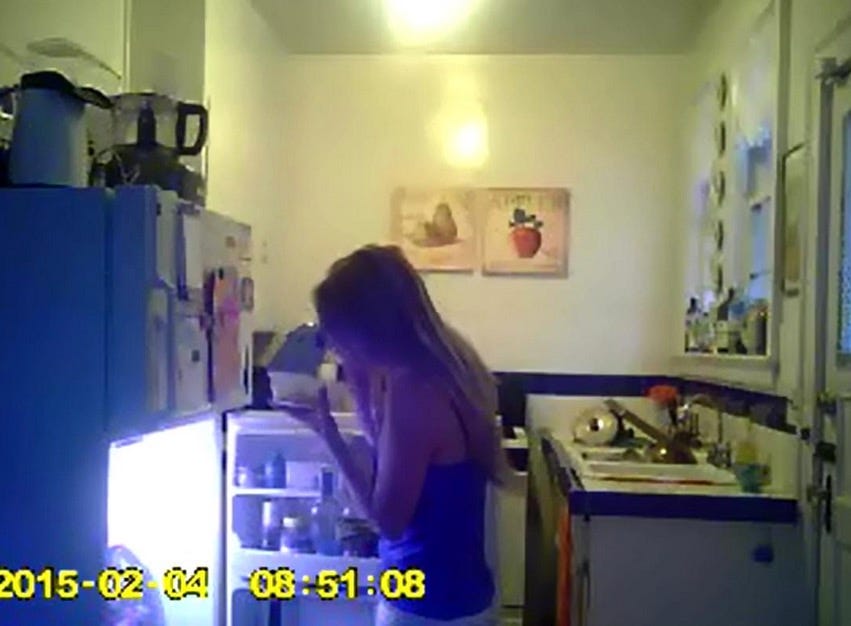
Find the location of a particular element. The image size is (851, 626). faucet is located at coordinates (686, 406).